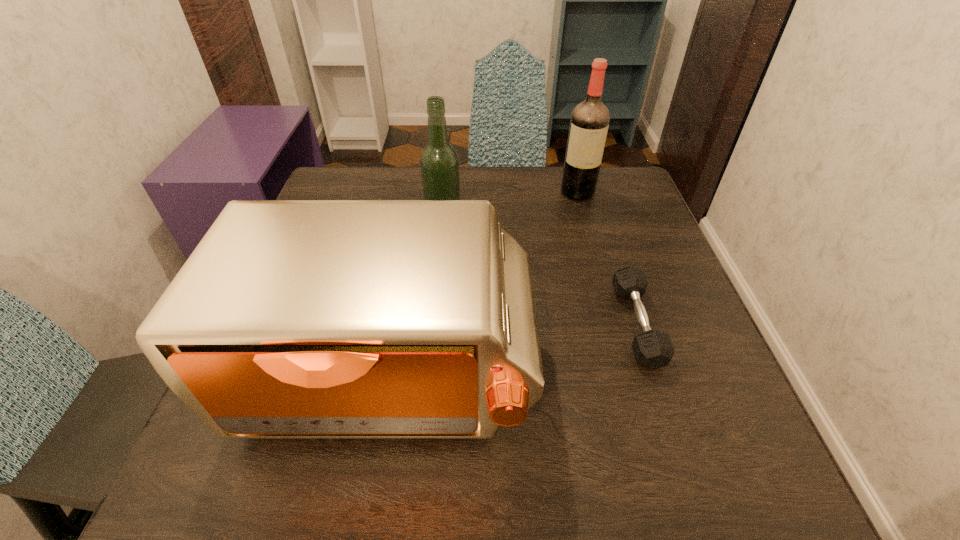
Identify the location of object positioned at the left edge. Image resolution: width=960 pixels, height=540 pixels. (292, 319).

Find the location of a particular element. Image resolution: width=960 pixels, height=540 pixels. liquor situated at the right edge is located at coordinates (589, 123).

Identify the location of dumbbell that is at the right edge. The image size is (960, 540). (652, 348).

I want to click on object at the near left corner, so click(292, 319).

This screenshot has width=960, height=540. In order to click on object that is positioned at the far right corner in this screenshot , I will do `click(589, 123)`.

Locate an element on the screen. blank space at the far edge of the desktop is located at coordinates (467, 184).

Image resolution: width=960 pixels, height=540 pixels. I want to click on vacant area at the near edge of the desktop, so point(460,474).

Where is `free space at the right edge of the desktop`? The image size is (960, 540). free space at the right edge of the desktop is located at coordinates (655, 261).

At what (x,y) coordinates should I click in order to perform the action: click on vacant space at the far left corner of the desktop. Please return your answer as a coordinate pair (x, y). The height and width of the screenshot is (540, 960). Looking at the image, I should click on (358, 171).

In order to click on free space at the near left corner of the desktop in this screenshot , I will do `click(304, 456)`.